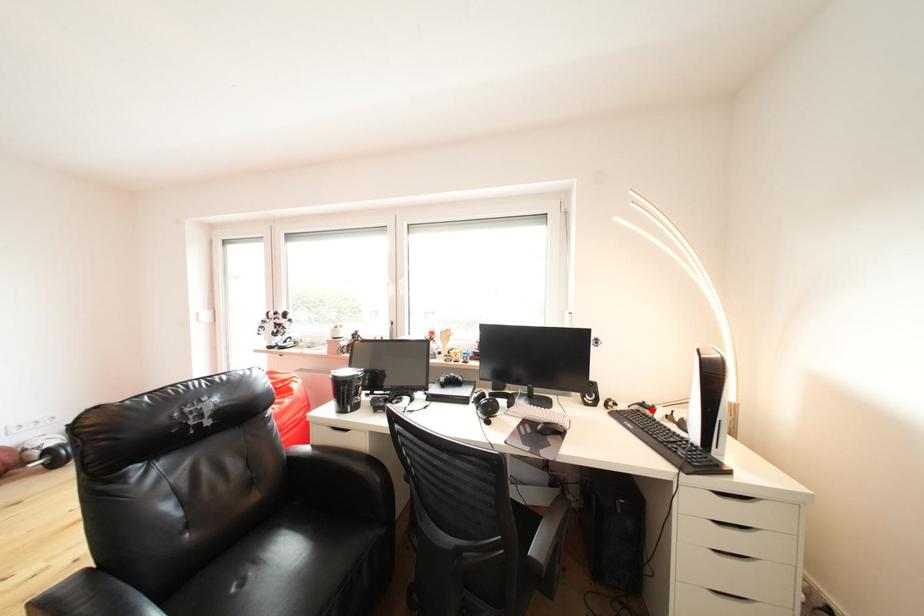
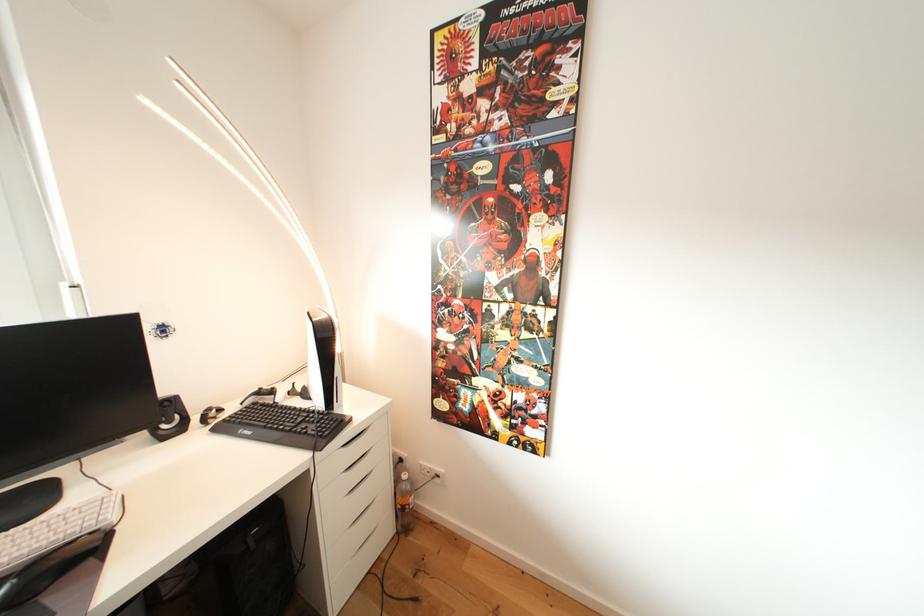
Where in the second image is the point corresponding to the highlighted location from the first image?

(268, 398)